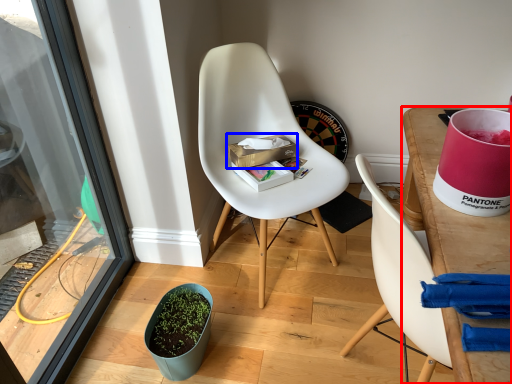
Question: Which object appears closest to the camera in this image, desk (highlighted by a red box) or box (highlighted by a blue box)?

Choices:
 (A) desk
 (B) box

Answer: (A)